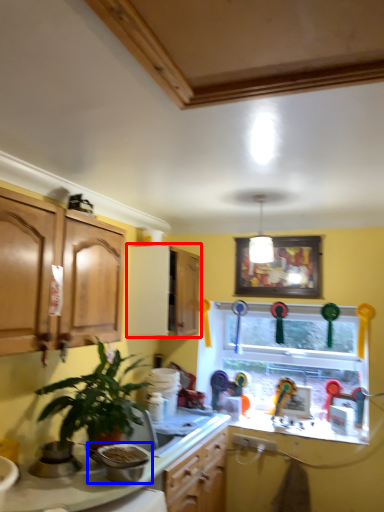
Question: Among these objects, which one is farthest to the camera, cabinetry (highlighted by a red box) or appliance (highlighted by a blue box)?

Choices:
 (A) cabinetry
 (B) appliance

Answer: (A)